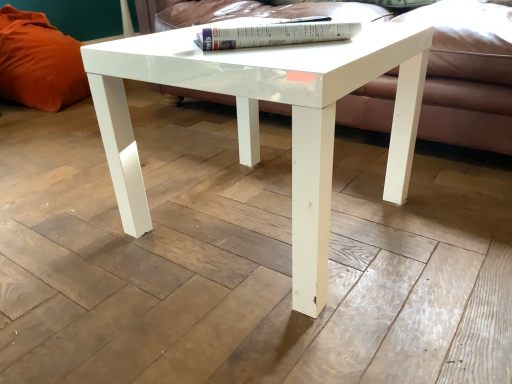
I want to click on free space to the right of white glossy coffee table at center, so click(x=423, y=216).